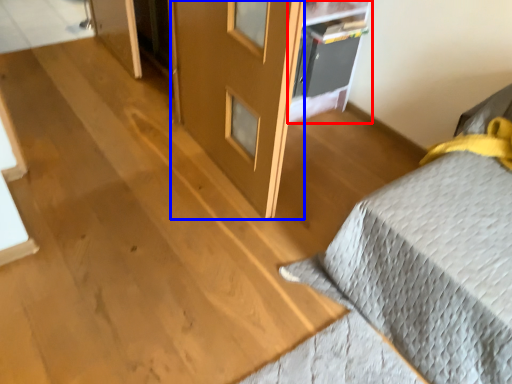
Question: Which object is further to the camera taking this photo, shelf (highlighted by a red box) or screen door (highlighted by a blue box)?

Choices:
 (A) shelf
 (B) screen door

Answer: (A)